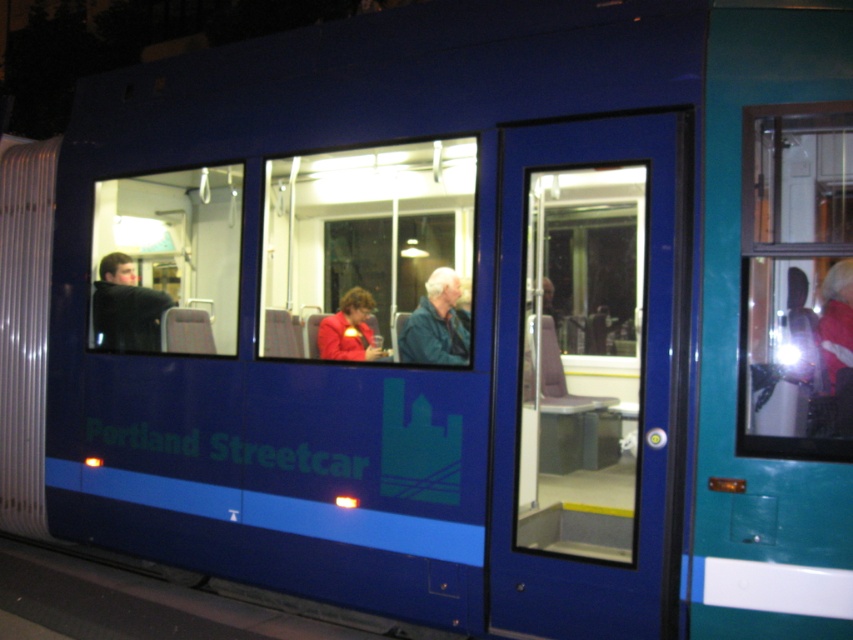
Who is positioned more to the right, transparent glass window at center right or transparent glass window at center?

transparent glass window at center right is more to the right.

Which is behind, point (764, 116) or point (154, 312)?

The point (154, 312) is more distant.

Image resolution: width=853 pixels, height=640 pixels. Find the location of `transparent glass window at center right`. transparent glass window at center right is located at coordinates (798, 280).

Does transparent glass window at center right have a greater width compared to matte red jacket at center?

No, transparent glass window at center right is not wider than matte red jacket at center.

Who is more forward, (770, 166) or (370, 330)?

Point (770, 166) is in front.

Identify the location of transparent glass window at center right. (798, 280).

Does point (763, 314) lie behind point (444, 336)?

No, (763, 314) is closer to viewer.

Who is shorter, transparent glass window at center right or blue leather jacket at center?

blue leather jacket at center is shorter.

Who is more distant from viewer, (x=815, y=234) or (x=453, y=339)?

Positioned behind is point (x=453, y=339).

At what (x,y) coordinates should I click in order to perform the action: click on transparent glass window at center right. Please return your answer as a coordinate pair (x, y). The width and height of the screenshot is (853, 640). Looking at the image, I should click on (798, 280).